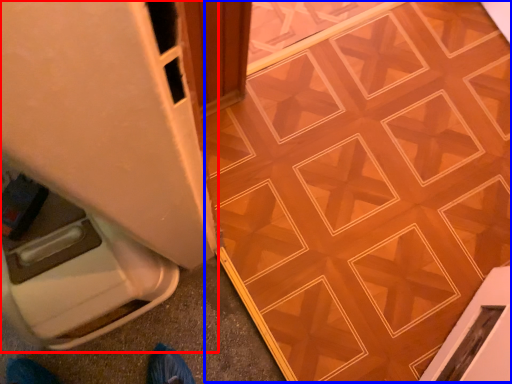
Question: Which object is closer to the camera taking this photo, appliance (highlighted by a red box) or ceramic tile (highlighted by a blue box)?

Choices:
 (A) appliance
 (B) ceramic tile

Answer: (A)